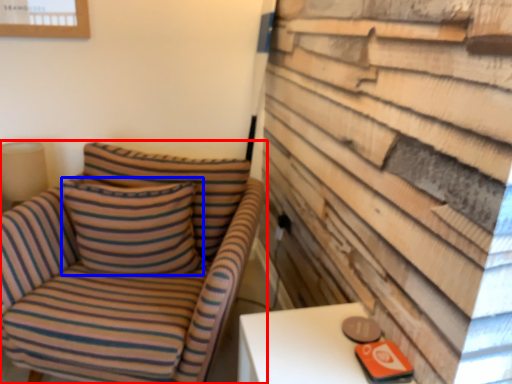
Question: Which object is further to the camera taking this photo, chair (highlighted by a red box) or pillow (highlighted by a blue box)?

Choices:
 (A) chair
 (B) pillow

Answer: (B)